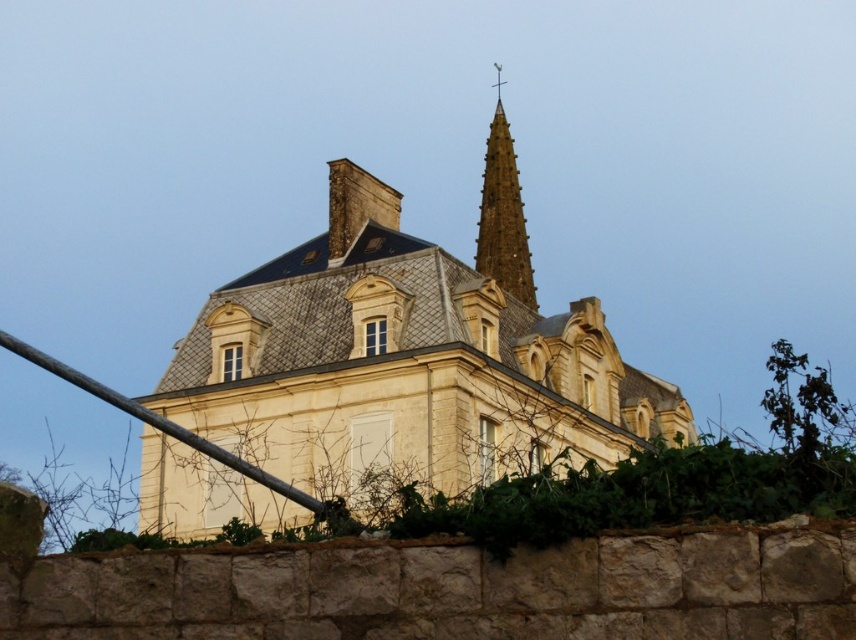
Looking at this image, is white stone church at center to the left of metallic pole at lower left from the viewer's perspective?

Incorrect, white stone church at center is not on the left side of metallic pole at lower left.

Is point (298, 272) closer to viewer compared to point (153, 416)?

No.

Between point (290, 336) and point (223, 449), which one is positioned in front?

Point (223, 449) is in front.

Where is `white stone church at center`? white stone church at center is located at coordinates (409, 353).

Is white stone church at center taller than smooth brown spire at upper center?

Yes.

Which is in front, point (283, 426) or point (494, 244)?

Point (283, 426) is in front.

You are a GUI agent. You are given a task and a screenshot of the screen. Output one action in this format:
    pyautogui.click(x=<x>, y=<y>)
    Task: Click on the white stone church at center
    
    Given the screenshot: What is the action you would take?
    pyautogui.click(x=409, y=353)

Between smooth brown spire at upper center and metallic pole at lower left, which one is positioned lower?

Positioned lower is metallic pole at lower left.

Identify the location of smooth brown spire at upper center. (503, 214).

At what (x,y) coordinates should I click in order to perform the action: click on smooth brown spire at upper center. Please return your answer as a coordinate pair (x, y). The height and width of the screenshot is (640, 856). Looking at the image, I should click on (503, 214).